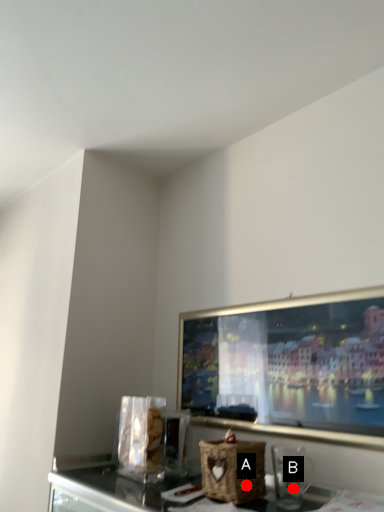
Question: Two points are circled on the image, labeled by A and B beside each circle. Which point is further to the camera?

Choices:
 (A) A is further
 (B) B is further

Answer: (B)